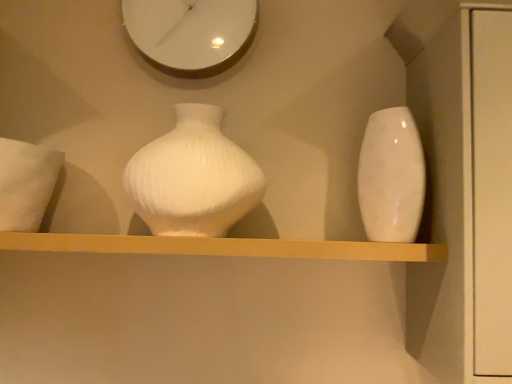
Question: In the image, is white soft pillow at left positioned in front of or behind white ribbed vase at center, which is the 1th vase in left-to-right order?

Choices:
 (A) behind
 (B) front

Answer: (B)

Question: From the image's perspective, is white soft pillow at left positioned above or below white ribbed vase at center, placed as the second vase when sorted from right to left?

Choices:
 (A) above
 (B) below

Answer: (B)

Question: Which object is the farthest from the white soft pillow at left?

Choices:
 (A) matte white shelf at center
 (B) white ribbed vase at center, placed as the second vase when sorted from right to left
 (C) glossy ceramic vase at right, arranged as the 2th vase when viewed from the left
 (D) white glossy clock at upper center

Answer: (C)

Question: Which of these objects is positioned closest to the matte white shelf at center?

Choices:
 (A) glossy ceramic vase at right, placed as the first vase when sorted from right to left
 (B) white glossy clock at upper center
 (C) white soft pillow at left
 (D) white ribbed vase at center, placed as the second vase when sorted from right to left

Answer: (D)